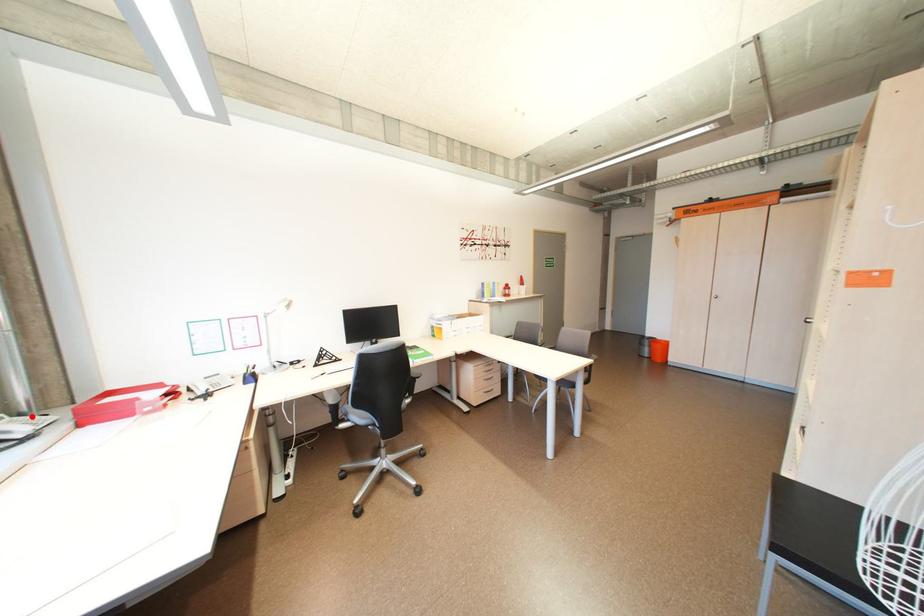
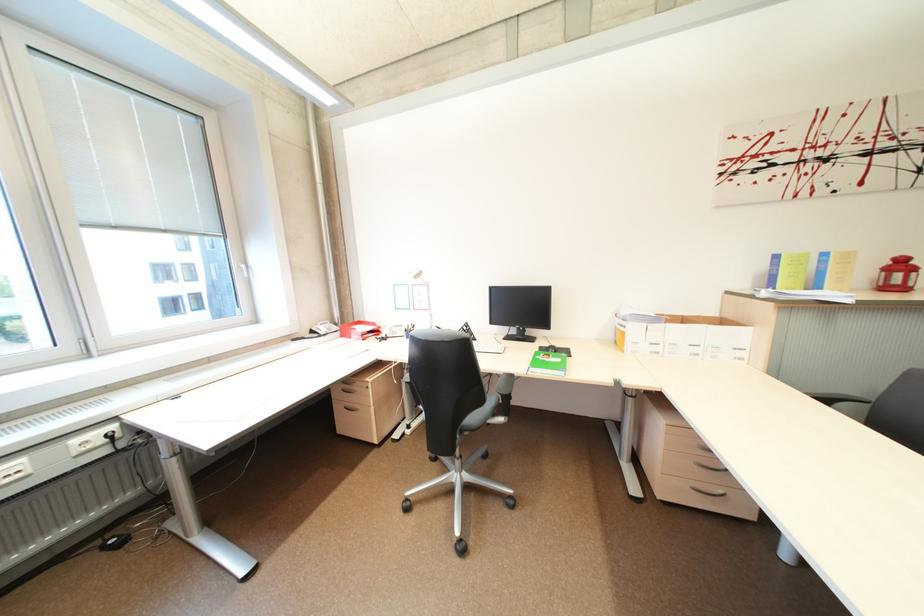
Question: I am providing you with two images of the same scene from different viewpoints. Image1 has a red point marked. In image2, the corresponding 3D location appears at what relative position? Reply with the corresponding letter.

Choices:
 (A) Closer
 (B) Farther

Answer: (A)